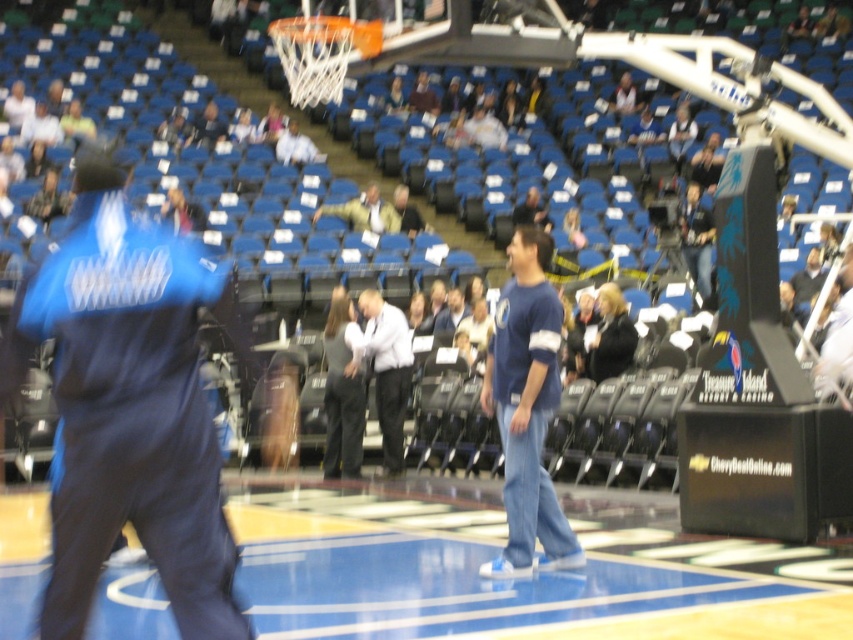
Question: Among these objects, which one is farthest from the camera?

Choices:
 (A) blue cotton shirt at center
 (B) light brown leather jacket at center
 (C) white shirt at center

Answer: (B)

Question: Which of the following is the closest to the observer?

Choices:
 (A) blue glossy court at center
 (B) blue cotton shirt at center
 (C) white shirt at center
 (D) blue fabric mascot at left

Answer: (D)

Question: Which object is closer to the camera taking this photo?

Choices:
 (A) white shirt at center
 (B) blue fabric mascot at left
 (C) blue cotton shirt at center

Answer: (B)

Question: Is blue cotton shirt at center above light brown leather jacket at center?

Choices:
 (A) yes
 (B) no

Answer: (B)

Question: Is blue glossy court at center above blue fabric mascot at left?

Choices:
 (A) no
 (B) yes

Answer: (A)

Question: Is blue fabric mascot at left wider than blue cotton shirt at center?

Choices:
 (A) yes
 (B) no

Answer: (A)